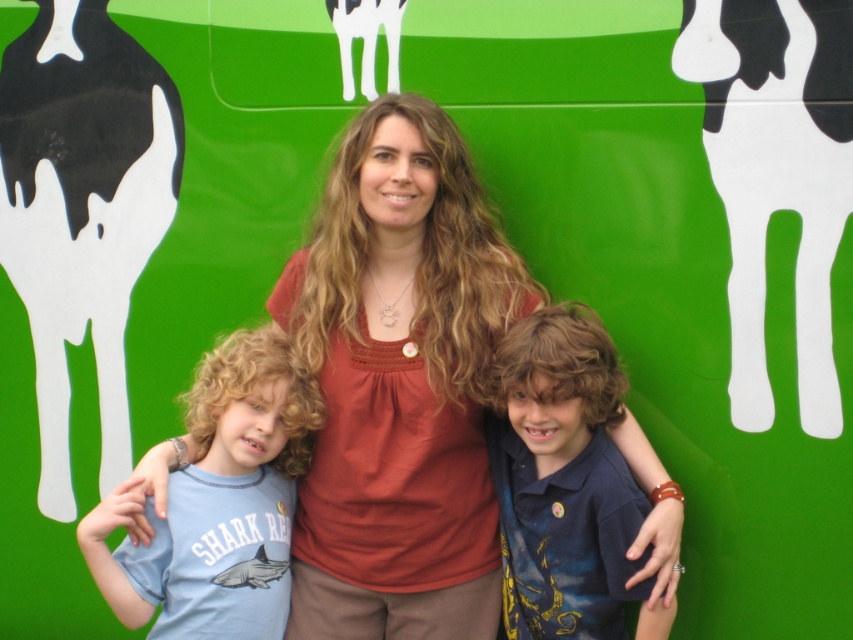
Who is more forward, (28, 81) or (532, 432)?

Point (532, 432) is in front.

Is black glossy cow at left taller than blue cotton shirt at center?

Yes.

Which is behind, point (24, 140) or point (515, 433)?

Positioned behind is point (24, 140).

The width and height of the screenshot is (853, 640). Find the location of `black glossy cow at left`. black glossy cow at left is located at coordinates 82,211.

Does light blue cotton t-shirt at left appear on the right side of white matte cow at upper center?

Incorrect, light blue cotton t-shirt at left is not on the right side of white matte cow at upper center.

Between point (184, 488) and point (397, 28), which one is positioned behind?

Positioned behind is point (397, 28).

Identify the location of light blue cotton t-shirt at left. (218, 502).

Does blue cotton shirt at center have a lesser height compared to white matte cow at upper center?

No, blue cotton shirt at center is not shorter than white matte cow at upper center.

Is point (576, 620) positioned behind point (398, 44)?

No, (576, 620) is in front of (398, 44).

Does point (541, 330) lie behind point (363, 49)?

No, it is in front of (363, 49).

Find the location of a particular element. The height and width of the screenshot is (640, 853). blue cotton shirt at center is located at coordinates (564, 483).